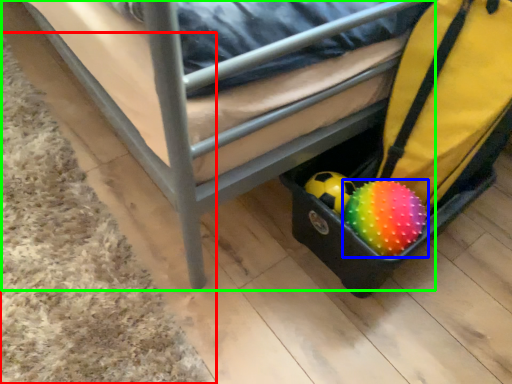
Question: Which object is positioned closest to mat (highlighted by a red box)? Select from ball (highlighted by a blue box) and furniture (highlighted by a green box).

Choices:
 (A) ball
 (B) furniture

Answer: (B)